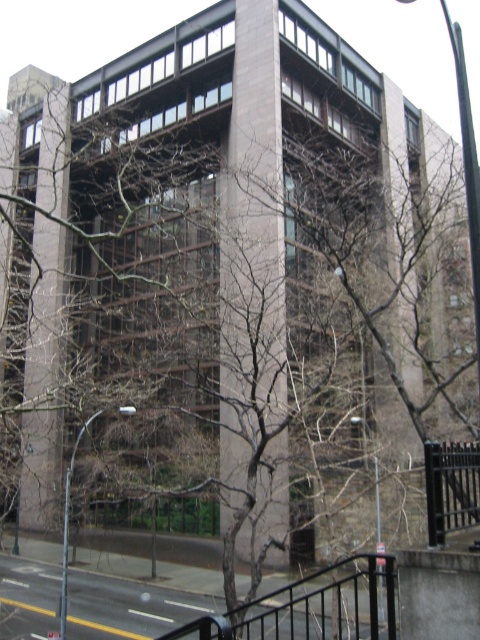
Between black metal/rail at lower right and black metal fence at lower right, which one appears on the left side from the viewer's perspective?

black metal/rail at lower right is more to the left.

Does point (227, 621) lie in front of point (456, 449)?

Yes, it is.

Which is in front, point (282, 605) or point (475, 476)?

Point (475, 476) is in front.

At what (x,y) coordinates should I click in order to perform the action: click on black metal/rail at lower right. Please return your answer as a coordinate pair (x, y). Image resolution: width=480 pixels, height=640 pixels. Looking at the image, I should click on (311, 605).